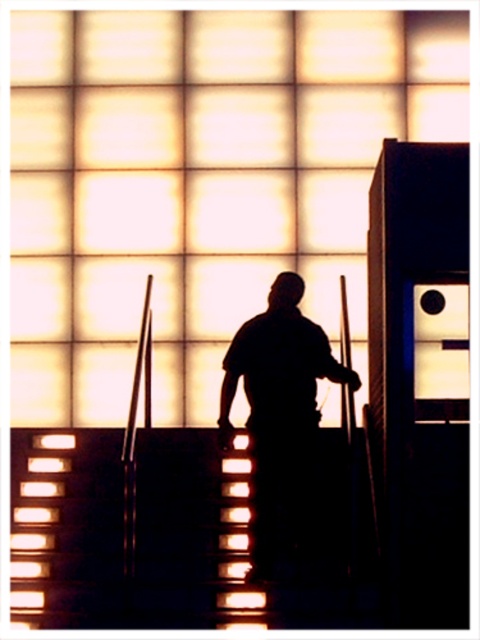
Does point (288, 429) come in front of point (236, 499)?

Yes, point (288, 429) is closer to viewer.

At what (x,y) coordinates should I click in order to perform the action: click on black matte figure at center. Please return your answer as a coordinate pair (x, y). The height and width of the screenshot is (640, 480). Looking at the image, I should click on (278, 410).

The image size is (480, 640). I want to click on black matte figure at center, so click(x=278, y=410).